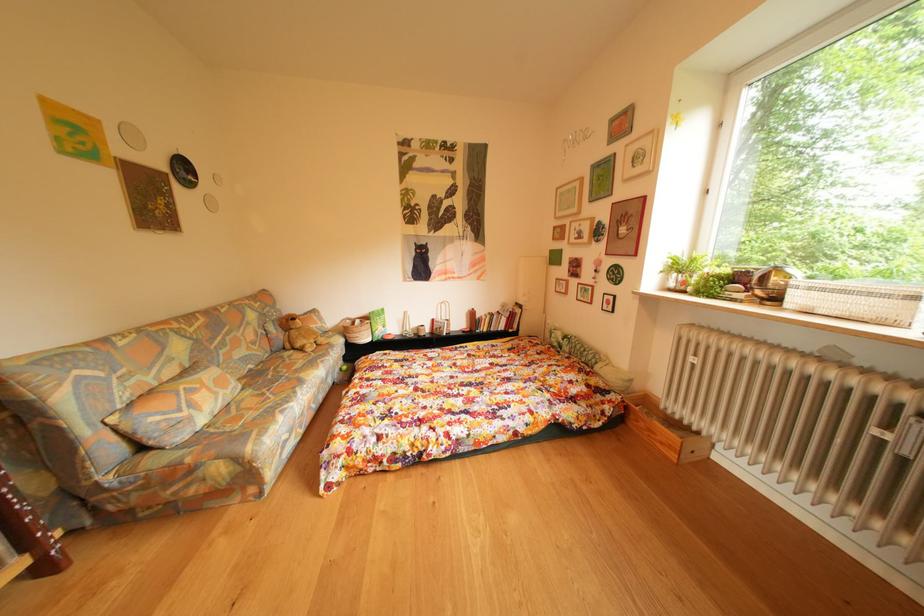
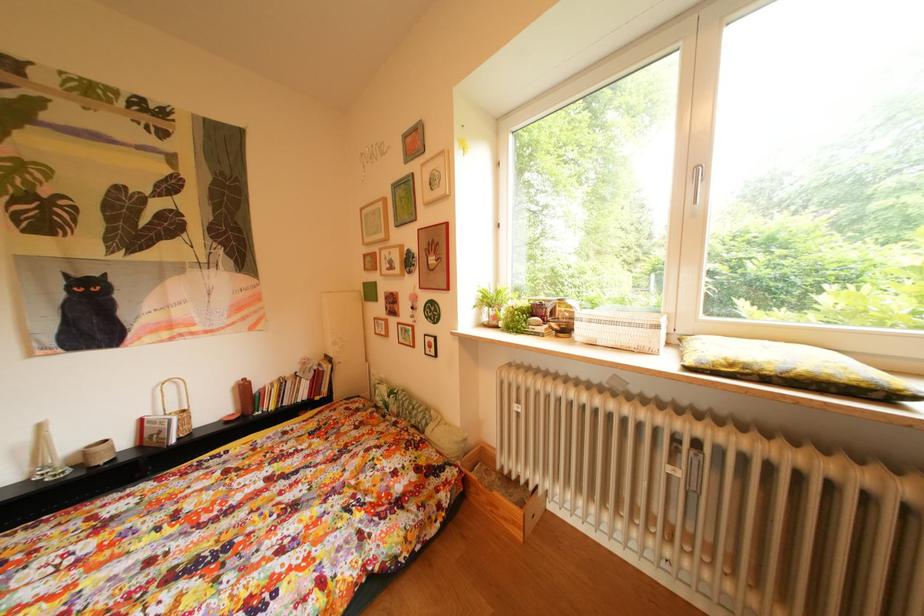
Question: The camera is either moving clockwise (left) or counter-clockwise (right) around the object. The first image is from the beginning of the video and the second image is from the end. Is the camera moving left or right when shooting the video?

Choices:
 (A) Left
 (B) Right

Answer: (A)